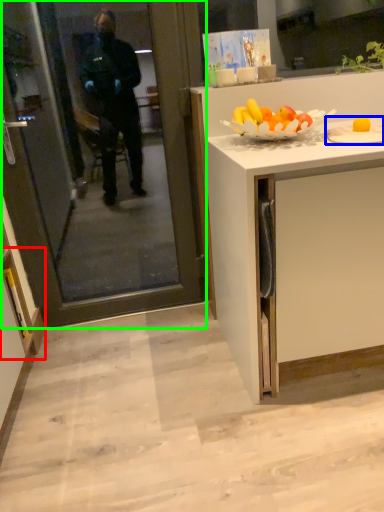
Question: Which is nearer to the cabinetry (highlighted by a red box)? plate (highlighted by a blue box) or screen door (highlighted by a green box).

Choices:
 (A) plate
 (B) screen door

Answer: (B)